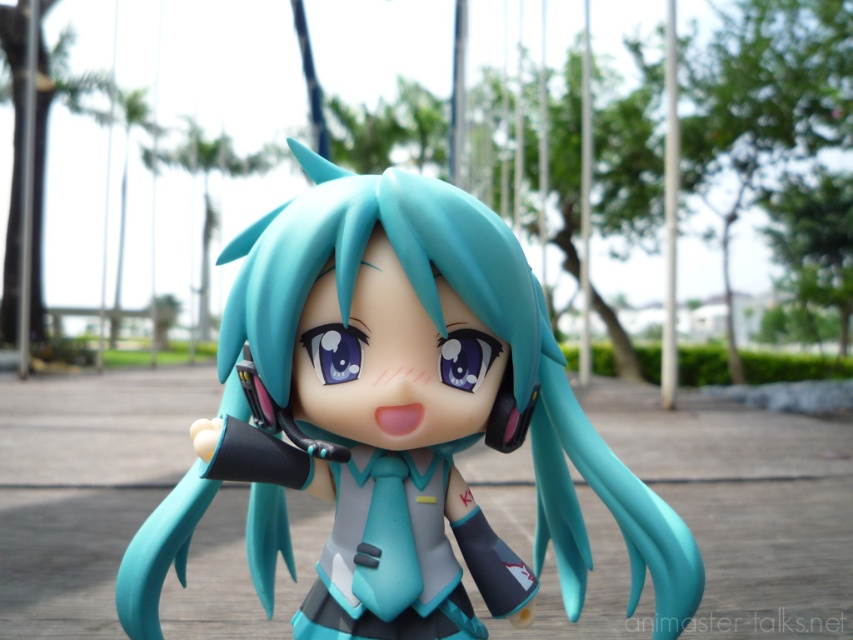
Question: Which of the following is the closest to the observer?

Choices:
 (A) matte plastic school uniform at center
 (B) matte plastic figure at center

Answer: (B)

Question: Does matte plastic figure at center have a smaller size compared to matte plastic school uniform at center?

Choices:
 (A) yes
 (B) no

Answer: (B)

Question: Does matte plastic figure at center have a greater width compared to matte plastic school uniform at center?

Choices:
 (A) yes
 (B) no

Answer: (A)

Question: Which point is closer to the camera?

Choices:
 (A) (508, 572)
 (B) (311, 230)

Answer: (B)

Question: Does matte plastic figure at center appear on the right side of matte plastic school uniform at center?

Choices:
 (A) yes
 (B) no

Answer: (B)

Question: Which point is farther to the camera?

Choices:
 (A) matte plastic figure at center
 (B) matte plastic school uniform at center

Answer: (B)